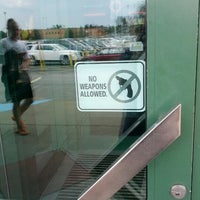
At what (x,y) coordinates should I click in order to perform the action: click on diagonal wood handle on right side of door. Please return your answer as a coordinate pair (x, y). The image size is (200, 200). Looking at the image, I should click on (131, 162).